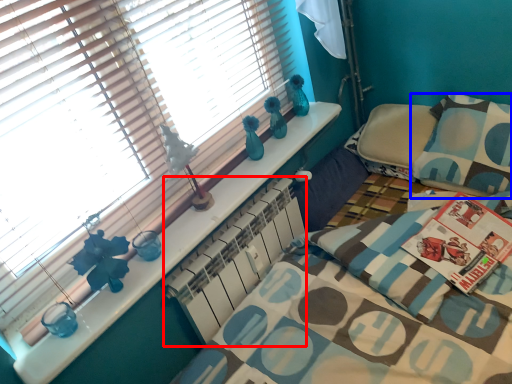
Question: Among these objects, which one is farthest to the camera, radiator (highlighted by a red box) or pillow (highlighted by a blue box)?

Choices:
 (A) radiator
 (B) pillow

Answer: (B)